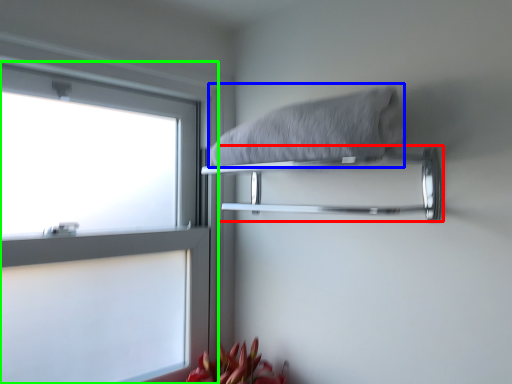
Question: Based on their relative distances, which object is farther from towel bar (highlighted by a red box)? Choose from bath towel (highlighted by a blue box) and window (highlighted by a green box).

Choices:
 (A) bath towel
 (B) window

Answer: (B)